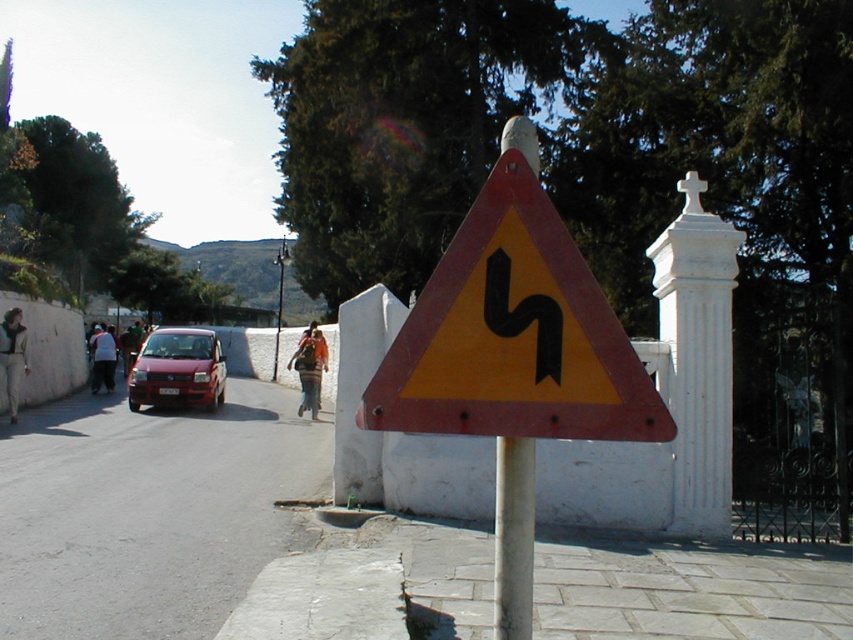
Is metallic yellow triangle at center thinner than shiny red car at center?

Correct, metallic yellow triangle at center's width is less than shiny red car at center's.

Who is taller, metallic yellow triangle at center or shiny red car at center?

shiny red car at center

Who is more forward, (585, 404) or (183, 356)?

Positioned in front is point (585, 404).

Identify the location of metallic yellow triangle at center. (514, 336).

Where is `gray concrete curb at lower left`? This screenshot has height=640, width=853. gray concrete curb at lower left is located at coordinates (323, 596).

Describe the element at coordinates (323, 596) in the screenshot. I see `gray concrete curb at lower left` at that location.

Between point (341, 618) and point (166, 401), which one is positioned behind?

Point (166, 401)

At what (x,y) coordinates should I click in order to perform the action: click on gray concrete curb at lower left. Please return your answer as a coordinate pair (x, y). The width and height of the screenshot is (853, 640). Looking at the image, I should click on (323, 596).

Is metallic yellow triangle at center taller than gray concrete curb at lower left?

Yes, metallic yellow triangle at center is taller than gray concrete curb at lower left.

Between metallic yellow triangle at center and gray concrete curb at lower left, which one has more height?

metallic yellow triangle at center is taller.

Between point (579, 332) and point (316, 586), which one is positioned in front?

Point (579, 332)

Identify the location of metallic yellow triangle at center. The height and width of the screenshot is (640, 853). (514, 336).